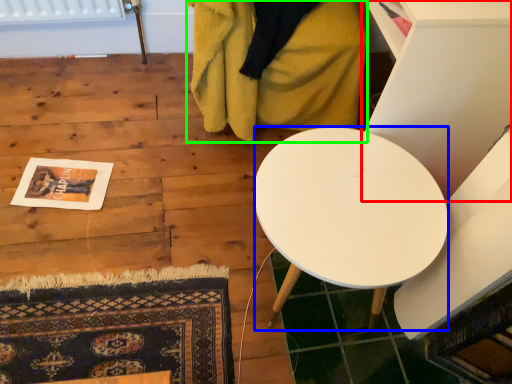
Question: Considering the real-world distances, which object is closest to furniture (highlighted by a red box)? desk (highlighted by a blue box) or blanket (highlighted by a green box).

Choices:
 (A) desk
 (B) blanket

Answer: (A)